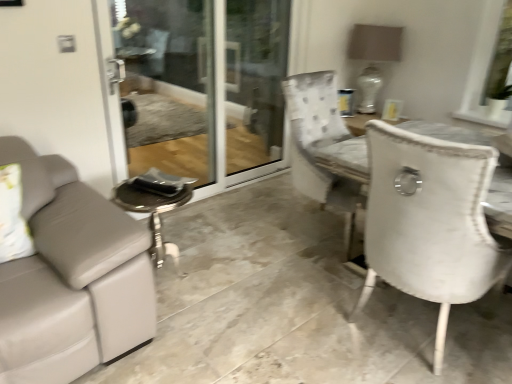
Question: Visually, is white ceramic lamp at upper right positioned to the left or to the right of transparent glass screen door at center?

Choices:
 (A) left
 (B) right

Answer: (B)

Question: Would you say white ceramic lamp at upper right is inside or outside transparent glass screen door at center?

Choices:
 (A) outside
 (B) inside

Answer: (A)

Question: Based on their relative distances, which object is nearer to the white fabric window screen at upper right?

Choices:
 (A) transparent glass screen door at center
 (B) white ceramic lamp at upper right

Answer: (B)

Question: Based on their relative distances, which object is nearer to the transparent glass screen door at center?

Choices:
 (A) white fabric window screen at upper right
 (B) white ceramic lamp at upper right

Answer: (B)